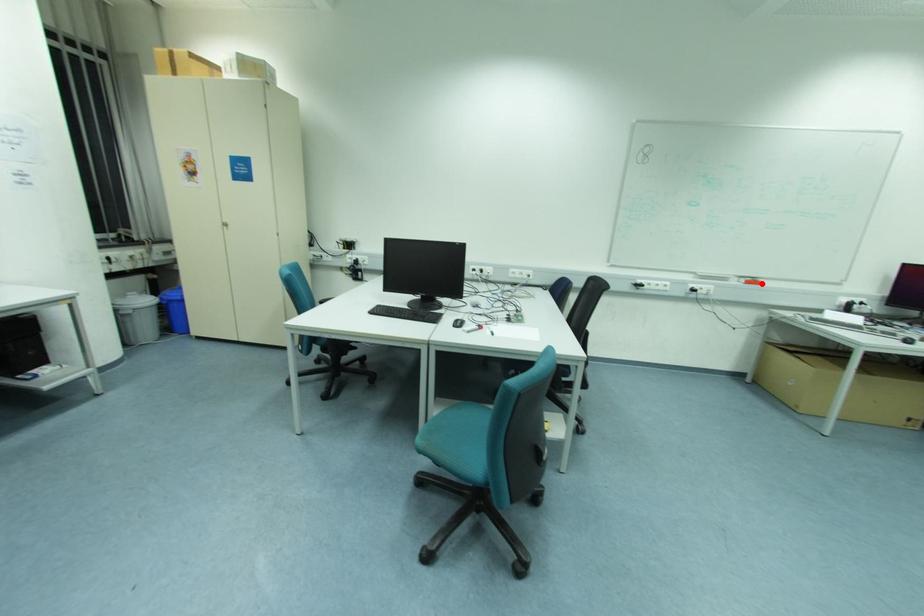
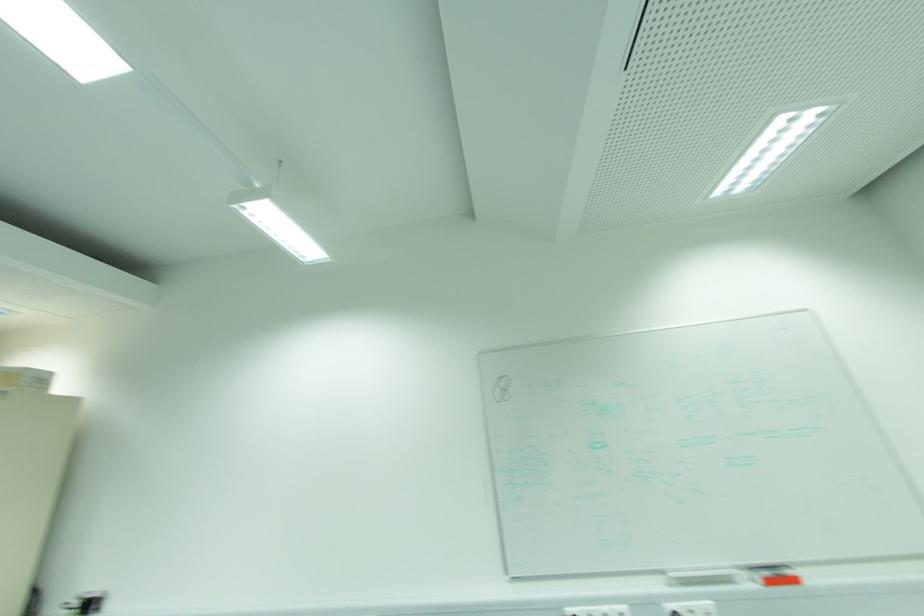
Question: I am providing you with two images of the same scene from different viewpoints. In image1, a red point is highlighted. Considering the same 3D point in image2, which of the following is correct?

Choices:
 (A) It is closer
 (B) It is farther

Answer: (A)